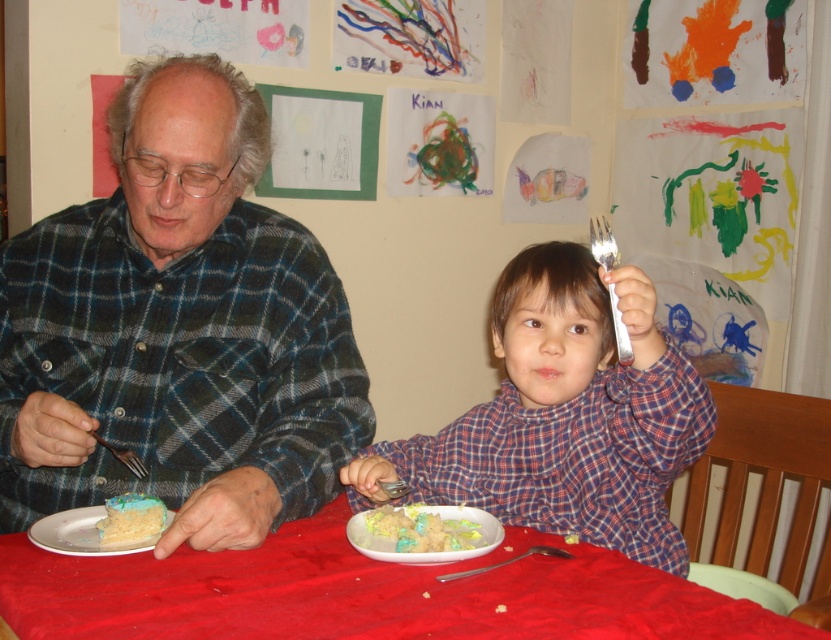
Question: Which of the following is the closest to the observer?

Choices:
 (A) white ceramic plate at lower left
 (B) red cloth table at center

Answer: (B)

Question: Is red cloth table at center below white ceramic plate at lower left?

Choices:
 (A) no
 (B) yes

Answer: (B)

Question: Considering the relative positions of red cloth table at center and white ceramic plate at lower left in the image provided, where is red cloth table at center located with respect to white ceramic plate at lower left?

Choices:
 (A) left
 (B) right

Answer: (B)

Question: Which point is farther to the camera?

Choices:
 (A) (370, 525)
 (B) (239, 372)
 (C) (175, 513)

Answer: (B)

Question: Among these points, which one is farthest from the camera?

Choices:
 (A) (136, 588)
 (B) (579, 348)
 (C) (91, 515)
 (D) (117, 500)

Answer: (B)

Question: In this image, where is plaid fabric shirt at center located relative to brushed metal fork at left?

Choices:
 (A) right
 (B) left

Answer: (A)